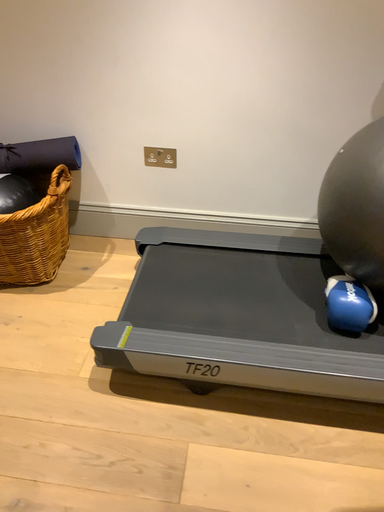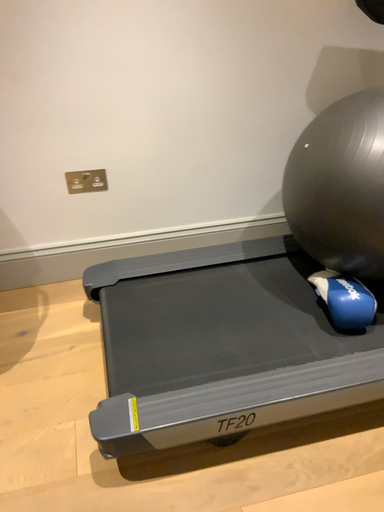
Question: Which way did the camera rotate in the video?

Choices:
 (A) rotated left
 (B) rotated right

Answer: (B)